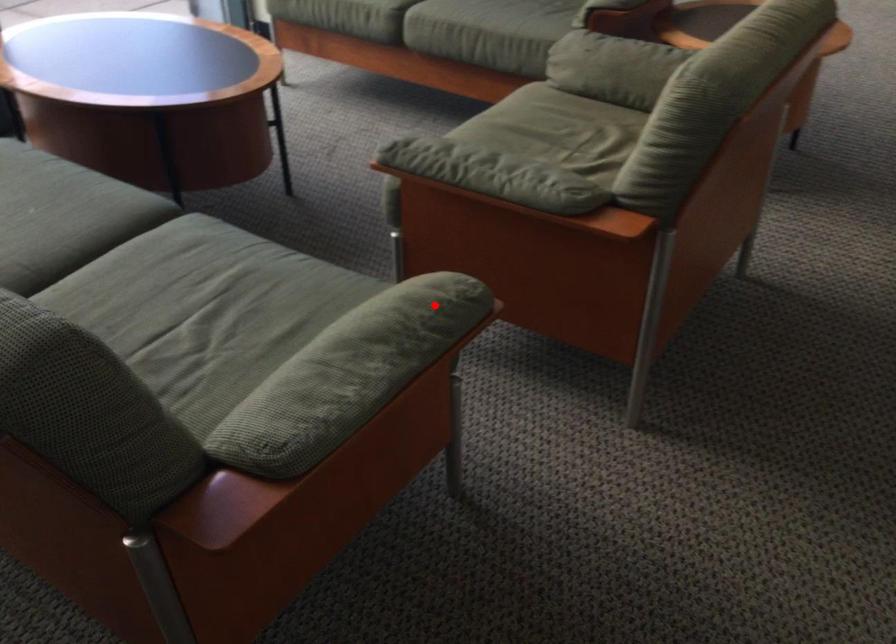
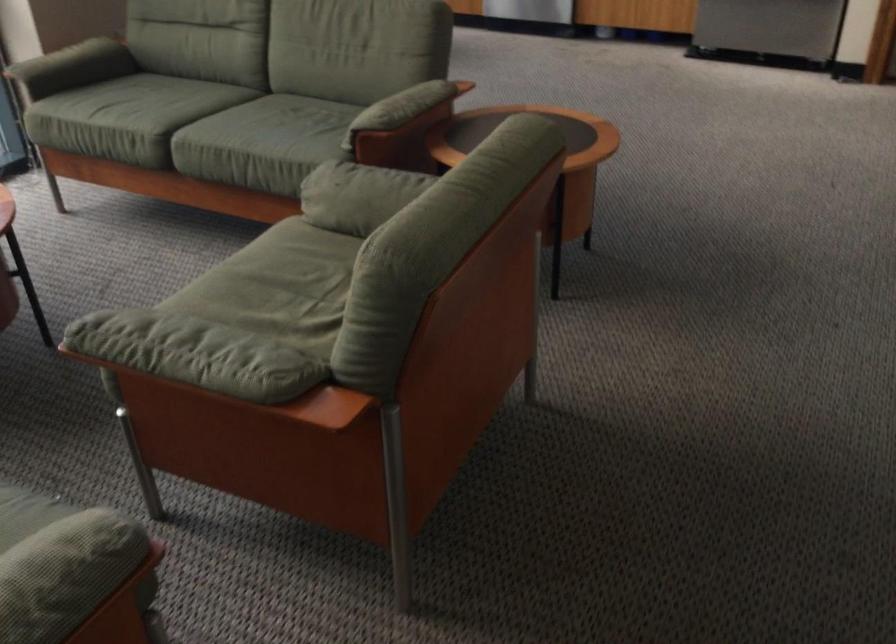
Question: I am providing you with two images of the same scene from different viewpoints. Image1 has a red point marked. In image2, the corresponding 3D location appears at what relative position? Reply with the corresponding letter.

Choices:
 (A) Closer
 (B) Farther

Answer: (A)